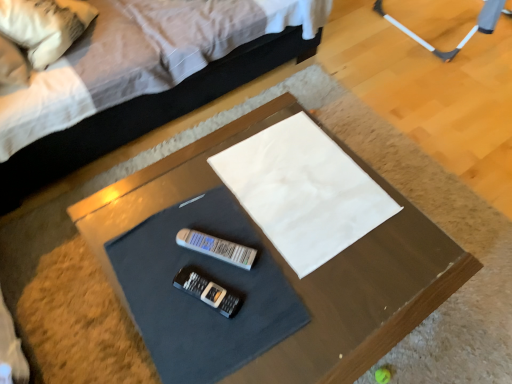
This screenshot has width=512, height=384. What are the coordinates of `empty space that is ontop of smooth brown table at center (from a real-world perspective)` in the screenshot? It's located at (263, 233).